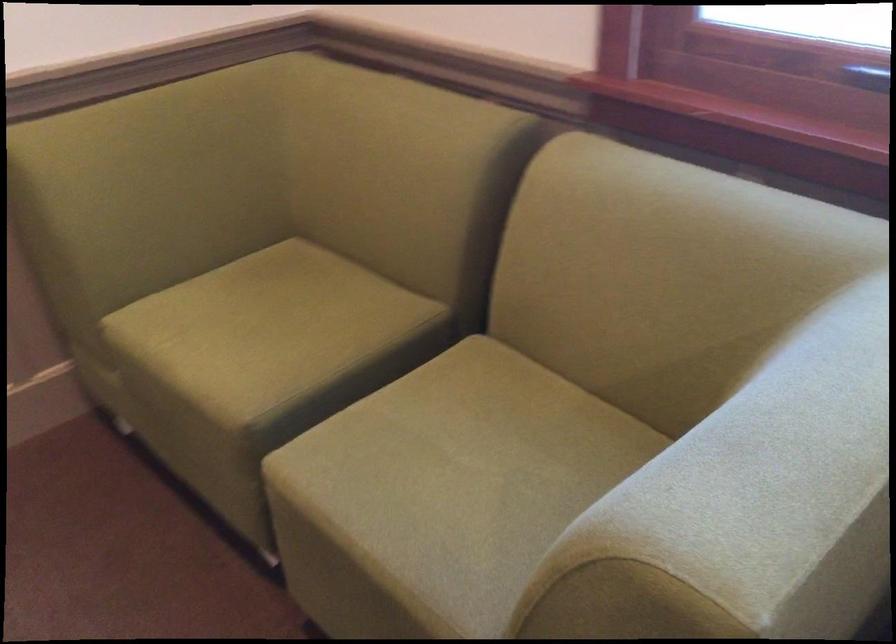
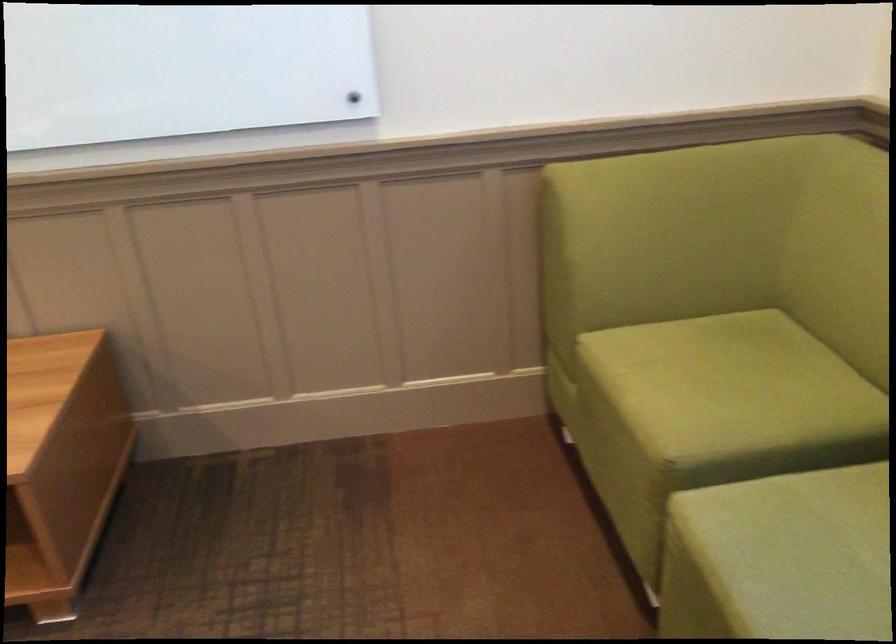
The point at (383, 486) is marked in the first image. Where is the corresponding point in the second image?

(780, 558)